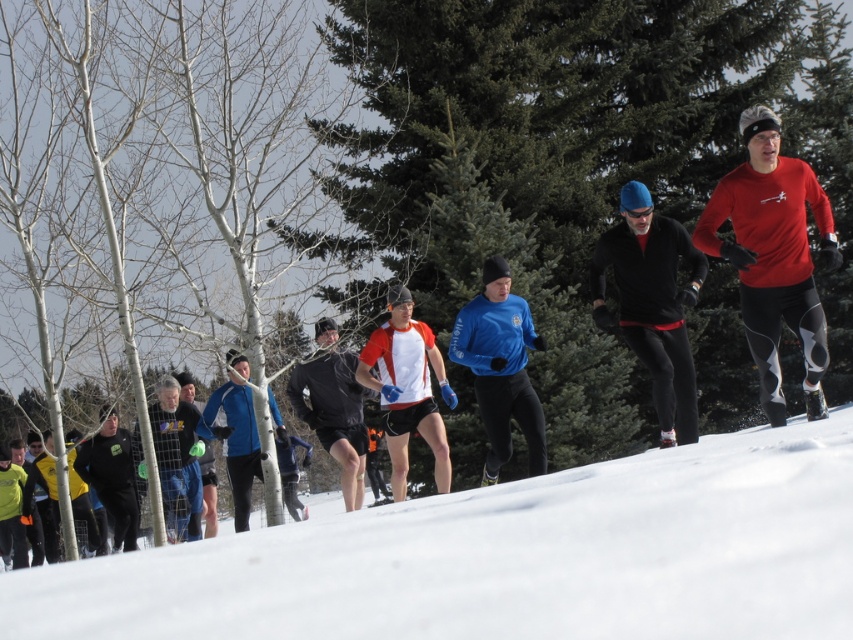
Who is more forward, (287, 548) or (485, 355)?

Point (287, 548) is in front.

Find the location of a particular element. The width and height of the screenshot is (853, 640). white snow at lower center is located at coordinates (508, 557).

Is matte red long-sleeve shirt at right positioned before black fleece jacket at center?

Yes, it is.

Where is `matte red long-sleeve shirt at right`? The height and width of the screenshot is (640, 853). matte red long-sleeve shirt at right is located at coordinates (775, 257).

In order to click on matte red long-sleeve shirt at right in this screenshot , I will do `click(775, 257)`.

Is matte red and white shirt at center thinner than blue fabric jacket at center?

Yes, matte red and white shirt at center is thinner than blue fabric jacket at center.

Does matte red and white shirt at center have a greater width compared to blue fabric jacket at center?

No, matte red and white shirt at center is not wider than blue fabric jacket at center.

Does point (424, 365) come in front of point (241, 362)?

That is True.

This screenshot has width=853, height=640. Find the location of `matte red and white shirt at center`. matte red and white shirt at center is located at coordinates (407, 388).